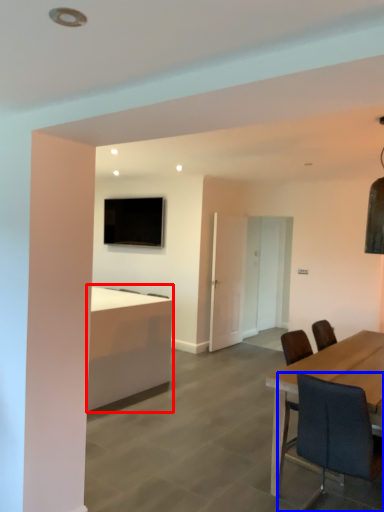
Question: Among these objects, which one is nearest to the camera, desk (highlighted by a red box) or chair (highlighted by a blue box)?

Choices:
 (A) desk
 (B) chair

Answer: (B)